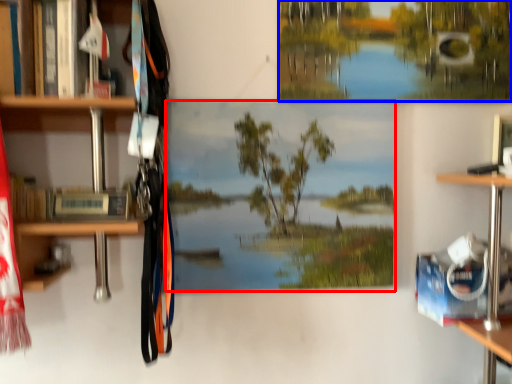
Question: Which of the following is the closest to the observer, mural (highlighted by a red box) or tree (highlighted by a blue box)?

Choices:
 (A) mural
 (B) tree

Answer: (A)